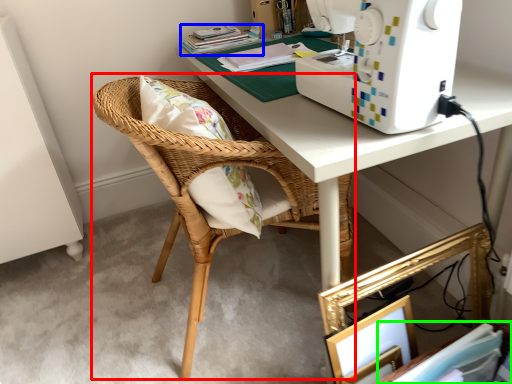
Question: Estimate the real-world distances between objects in this image. Which object is closer to chair (highlighted by a red box), book (highlighted by a blue box) or book (highlighted by a green box)?

Choices:
 (A) book
 (B) book

Answer: (A)